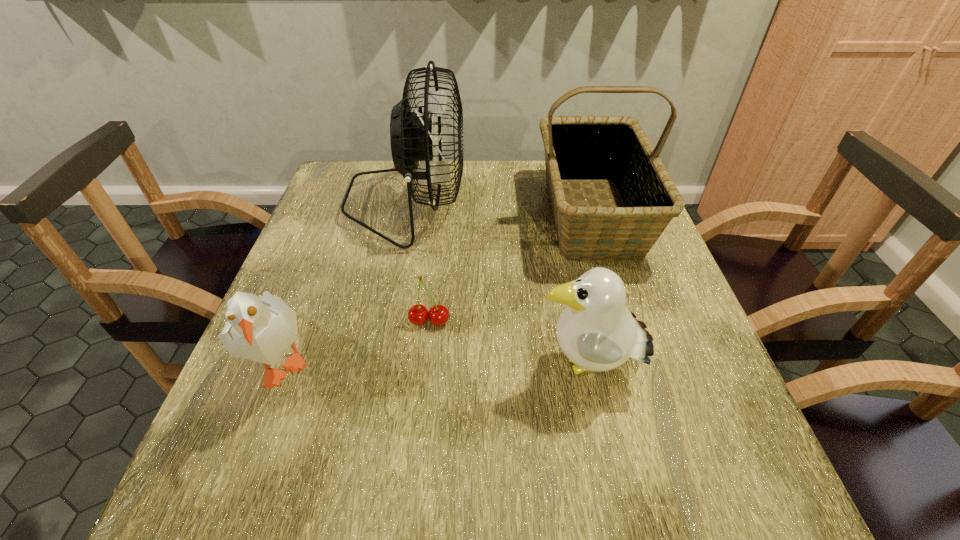
Find the location of a particular element. vacant area at the far edge of the desktop is located at coordinates [472, 195].

You are a GUI agent. You are given a task and a screenshot of the screen. Output one action in this format:
    pyautogui.click(x=<x>, y=<y>)
    Task: Click on the vacant space at the left edge of the desktop
    This screenshot has width=960, height=540.
    Given the screenshot: What is the action you would take?
    330,296

At what (x,y) coordinates should I click in order to perform the action: click on free space at the right edge. Please return your answer as a coordinate pair (x, y). Looking at the image, I should click on (658, 258).

This screenshot has width=960, height=540. Find the location of `vacant space at the far left corner of the desktop`. vacant space at the far left corner of the desktop is located at coordinates (331, 183).

Locate an element on the screen. This screenshot has width=960, height=540. free space between the fan and the shortest object is located at coordinates (419, 262).

Find the location of a particular element. The image size is (960, 540). free space between the right gull and the shortest object is located at coordinates (508, 345).

Where is `empty space that is in between the left gull and the right gull`? The height and width of the screenshot is (540, 960). empty space that is in between the left gull and the right gull is located at coordinates (436, 363).

Image resolution: width=960 pixels, height=540 pixels. Find the location of `free spot between the basket and the fan`. free spot between the basket and the fan is located at coordinates (499, 209).

Identify the location of empty location between the fan and the right gull. Image resolution: width=960 pixels, height=540 pixels. (497, 286).

Identify the location of vacant space that is in between the shortest object and the fan. Image resolution: width=960 pixels, height=540 pixels. click(419, 262).